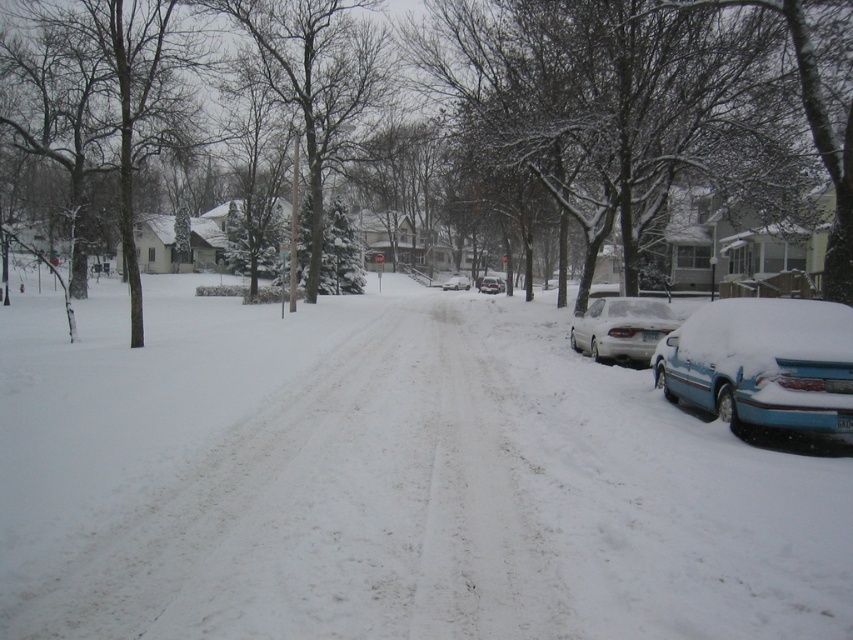
Question: Is blue matte car at right above white matte sedan at center?

Choices:
 (A) yes
 (B) no

Answer: (B)

Question: Which point appears farthest from the camera in this image?

Choices:
 (A) (578, 342)
 (B) (486, 280)
 (C) (734, 314)
 (D) (264, 337)

Answer: (B)

Question: Which point is farther from the camera taking this photo?

Choices:
 (A) (457, 284)
 (B) (589, 307)
 (C) (788, 401)
 (D) (491, 291)

Answer: (A)

Question: Can you confirm if blue matte car at right is bigger than white matte sedan at right?

Choices:
 (A) yes
 (B) no

Answer: (B)

Question: Among these objects, which one is farthest from the camera?

Choices:
 (A) white matte sedan at right
 (B) white matte sedan at center
 (C) white fluffy snow at center
 (D) sleek silver sedan at center

Answer: (B)

Question: Does white matte sedan at right have a greater width compared to sleek silver sedan at center?

Choices:
 (A) yes
 (B) no

Answer: (B)